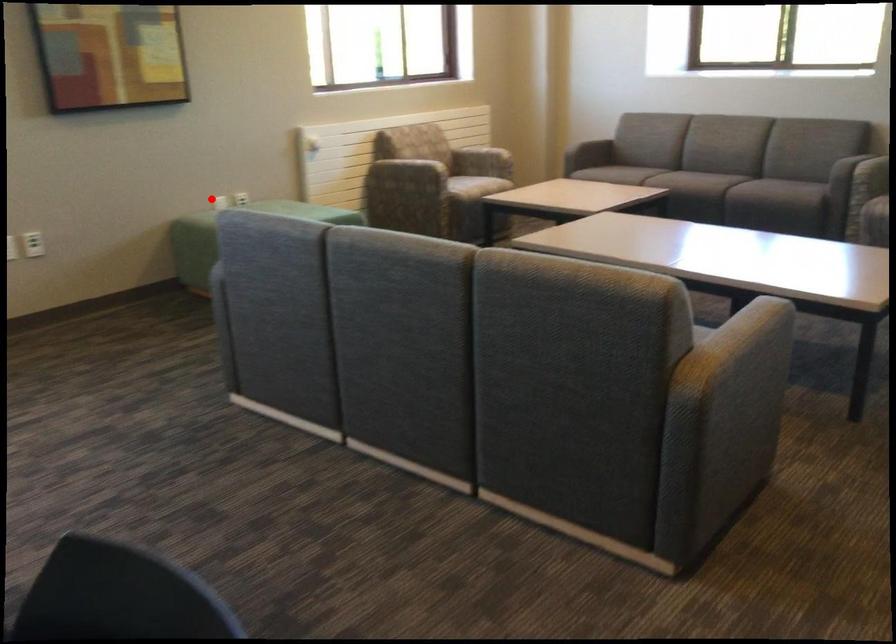
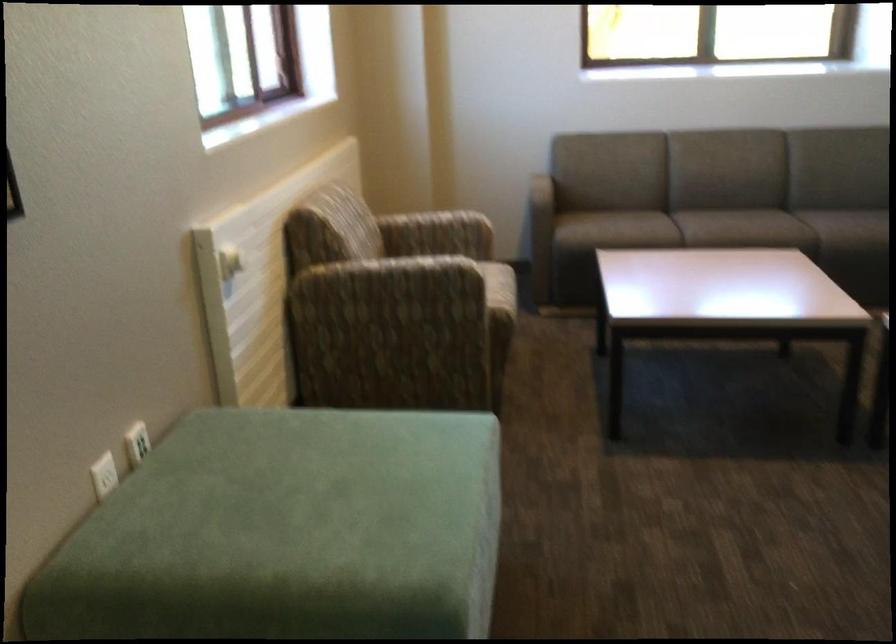
Question: I am providing you with two images of the same scene from different viewpoints. A red point is marked on the first image. At the location where the point appears in image 1, is it still visible in image 2?

Choices:
 (A) Yes
 (B) No

Answer: (A)